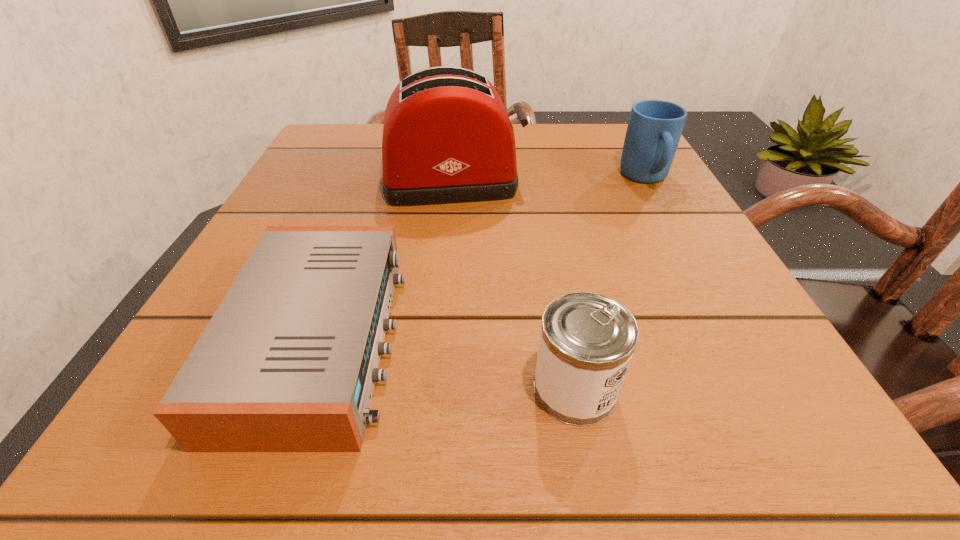
Identify the location of can located in the near edge section of the desktop. (587, 340).

You are a GUI agent. You are given a task and a screenshot of the screen. Output one action in this format:
    pyautogui.click(x=<x>, y=<y>)
    Task: Click on the radio receiver that is at the near edge
    The width and height of the screenshot is (960, 540).
    Given the screenshot: What is the action you would take?
    pyautogui.click(x=288, y=362)

Where is `object located at the left edge`? The height and width of the screenshot is (540, 960). object located at the left edge is located at coordinates (288, 362).

Locate an element on the screen. This screenshot has width=960, height=540. object located in the right edge section of the desktop is located at coordinates (654, 129).

The width and height of the screenshot is (960, 540). I want to click on object located in the near left corner section of the desktop, so click(288, 362).

The width and height of the screenshot is (960, 540). Identify the location of object present at the far right corner. (654, 129).

In the image, there is a desktop. Where is `free region at the left edge`? free region at the left edge is located at coordinates (328, 226).

Locate an element on the screen. Image resolution: width=960 pixels, height=540 pixels. free region at the right edge of the desktop is located at coordinates (698, 308).

At what (x,y) coordinates should I click in order to perform the action: click on vacant space at the far left corner. Please return your answer as a coordinate pair (x, y). Looking at the image, I should click on (335, 155).

Where is `free region at the far right corner`? The height and width of the screenshot is (540, 960). free region at the far right corner is located at coordinates (586, 125).